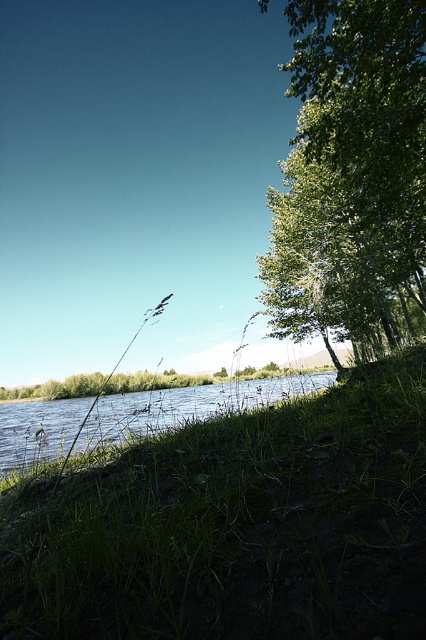
Question: Among these points, which one is farthest from the camera?

Choices:
 (A) (310, 568)
 (B) (405, 224)

Answer: (B)

Question: Does green leafy tree at right appear on the right side of green grassy river at lower left?

Choices:
 (A) no
 (B) yes

Answer: (B)

Question: Can you confirm if green grass at lower left is smaller than green leafy tree at right?

Choices:
 (A) yes
 (B) no

Answer: (A)

Question: Is green grass at lower left wider than green grassy river at lower left?

Choices:
 (A) no
 (B) yes

Answer: (A)

Question: Estimate the real-world distances between objects in this image. Which object is closer to the green grass at lower left?

Choices:
 (A) green grassy river at lower left
 (B) green leafy tree at right

Answer: (B)

Question: Which object appears farthest from the camera in this image?

Choices:
 (A) green grass at lower left
 (B) green leafy tree at right

Answer: (B)